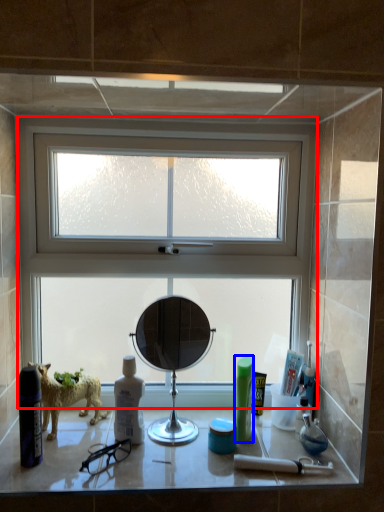
Question: Which object appears closest to the camera in this image, window (highlighted by a red box) or toiletry (highlighted by a blue box)?

Choices:
 (A) window
 (B) toiletry

Answer: (B)